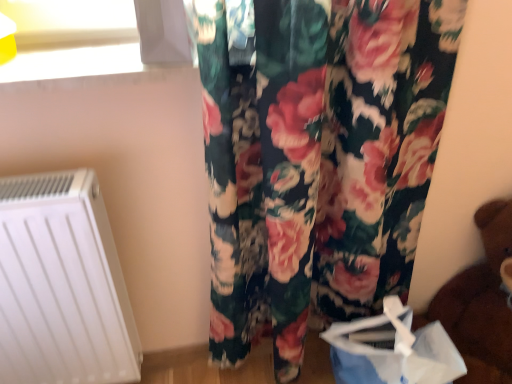
Question: Is white matte radiator at lower left far from blue paper bag at lower right?

Choices:
 (A) no
 (B) yes

Answer: (A)

Question: Is white matte radiator at lower left oriented towards blue paper bag at lower right?

Choices:
 (A) no
 (B) yes

Answer: (A)

Question: From a real-world perspective, is white matte radiator at lower left on top of blue paper bag at lower right?

Choices:
 (A) no
 (B) yes

Answer: (B)

Question: Is white matte radiator at lower left further to the viewer compared to blue paper bag at lower right?

Choices:
 (A) yes
 (B) no

Answer: (B)

Question: From the image's perspective, is white matte radiator at lower left on top of blue paper bag at lower right?

Choices:
 (A) yes
 (B) no

Answer: (A)

Question: Considering the positions of brown plush bear at lower right and blue paper bag at lower right in the image, is brown plush bear at lower right bigger or smaller than blue paper bag at lower right?

Choices:
 (A) big
 (B) small

Answer: (A)

Question: Considering the positions of brown plush bear at lower right and blue paper bag at lower right in the image, is brown plush bear at lower right wider or thinner than blue paper bag at lower right?

Choices:
 (A) wide
 (B) thin

Answer: (A)

Question: Considering the relative positions of brown plush bear at lower right and blue paper bag at lower right in the image provided, is brown plush bear at lower right to the left or to the right of blue paper bag at lower right?

Choices:
 (A) left
 (B) right

Answer: (B)

Question: From a real-world perspective, is brown plush bear at lower right positioned above or below blue paper bag at lower right?

Choices:
 (A) above
 (B) below

Answer: (A)

Question: Considering the positions of blue paper bag at lower right and brown plush bear at lower right in the image, is blue paper bag at lower right taller or shorter than brown plush bear at lower right?

Choices:
 (A) tall
 (B) short

Answer: (B)

Question: Does point (437, 357) appear closer or farther from the camera than point (489, 221)?

Choices:
 (A) farther
 (B) closer

Answer: (B)

Question: Considering their positions, is blue paper bag at lower right located in front of or behind brown plush bear at lower right?

Choices:
 (A) behind
 (B) front

Answer: (A)

Question: Is blue paper bag at lower right bigger or smaller than brown plush bear at lower right?

Choices:
 (A) big
 (B) small

Answer: (B)

Question: In terms of width, does white matte radiator at lower left look wider or thinner when compared to blue paper bag at lower right?

Choices:
 (A) thin
 (B) wide

Answer: (A)

Question: Visually, is white matte radiator at lower left positioned to the left or to the right of blue paper bag at lower right?

Choices:
 (A) left
 (B) right

Answer: (A)